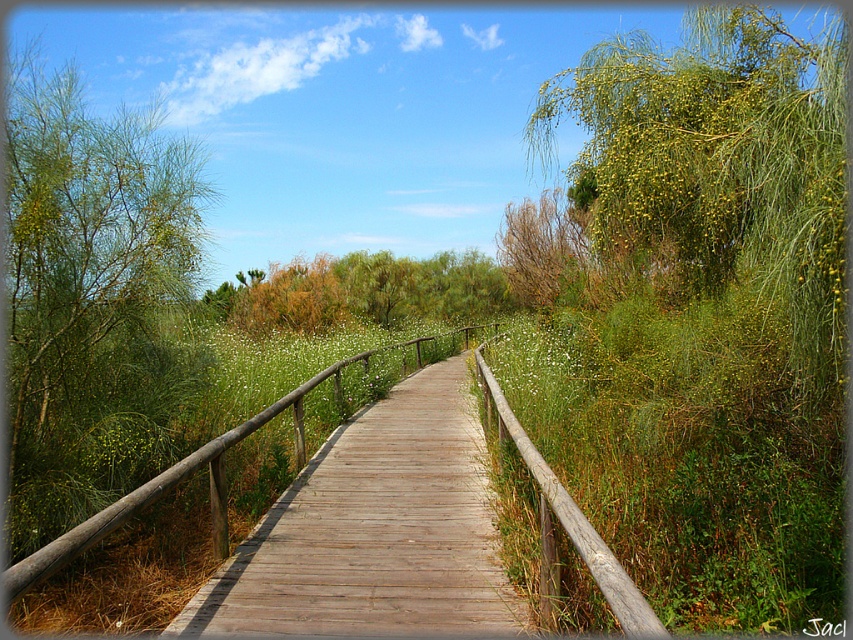
You are a landscape architect designing a new garden path. You want to place a bench between the green leafy tree at left and the brown textured bush at upper center. Which object should the bench be closer to if you want it to be near the larger of the two?

The bench should be closer to the brown textured bush at upper center because it occupies more space than the green leafy tree at left.